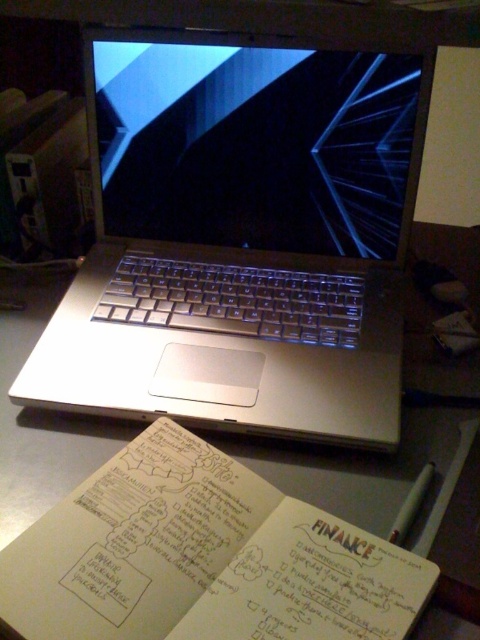
Who is shorter, silver metallic laptop at center or metallic table at center?

Standing shorter between the two is metallic table at center.

Is silver metallic laptop at center taller than metallic table at center?

Yes.

Is point (254, 326) behind point (342, 481)?

Yes, it is behind point (342, 481).

Identify the location of silver metallic laptop at center. The height and width of the screenshot is (640, 480). (240, 236).

Can you confirm if silver metallic laptop at center is taller than white paper notebook at lower left?

Correct, silver metallic laptop at center is much taller as white paper notebook at lower left.

Between silver metallic laptop at center and white paper notebook at lower left, which one is positioned higher?

silver metallic laptop at center is above.

This screenshot has width=480, height=640. What are the coordinates of `silver metallic laptop at center` in the screenshot? It's located at pyautogui.click(x=240, y=236).

At what (x,y) coordinates should I click in order to perform the action: click on silver metallic laptop at center. Please return your answer as a coordinate pair (x, y). This screenshot has width=480, height=640. Looking at the image, I should click on (240, 236).

Can you confirm if silver metallic laptop at center is positioned below satin black screen at center?

Yes, silver metallic laptop at center is below satin black screen at center.

Is the position of silver metallic laptop at center more distant than that of satin black screen at center?

No, it is not.

What do you see at coordinates (240, 236) in the screenshot? Image resolution: width=480 pixels, height=640 pixels. I see `silver metallic laptop at center` at bounding box center [240, 236].

I want to click on silver metallic laptop at center, so click(x=240, y=236).